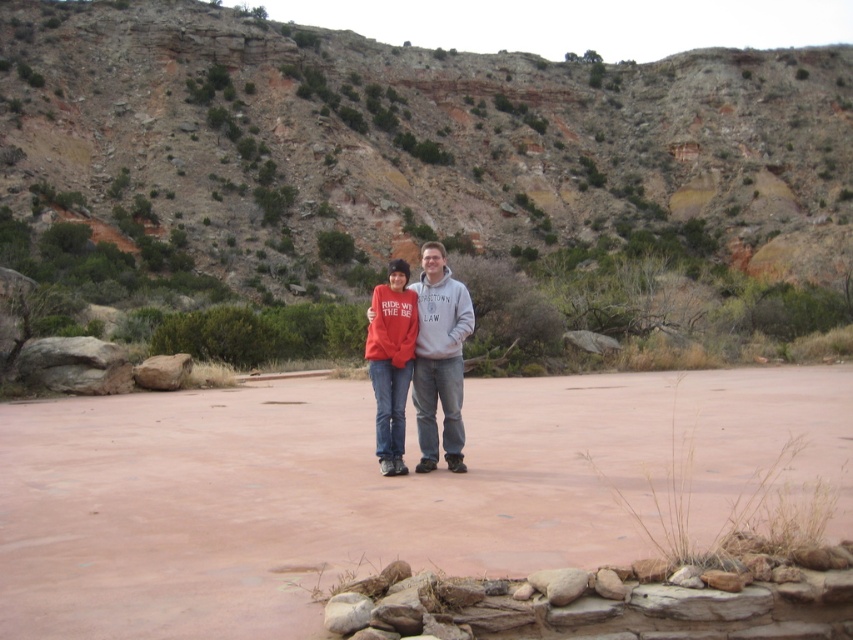
Is matte red hoodie at center below matte red sweatshirt at center?

Yes, matte red hoodie at center is below matte red sweatshirt at center.

In the scene shown: Can you confirm if matte red hoodie at center is taller than matte red sweatshirt at center?

Correct, matte red hoodie at center is much taller as matte red sweatshirt at center.

Where is `matte red hoodie at center`? The image size is (853, 640). matte red hoodie at center is located at coordinates (439, 356).

Can you confirm if dull brown rock at center is smaller than matte red hoodie at center?

No, dull brown rock at center is not smaller than matte red hoodie at center.

Can you confirm if dull brown rock at center is taller than matte red hoodie at center?

Indeed, dull brown rock at center has a greater height compared to matte red hoodie at center.

Is point (404, 145) positioned before point (456, 285)?

No, it is behind (456, 285).

Identify the location of dull brown rock at center. (416, 179).

Is reddish-brown dirt field at center wider than matte red sweatshirt at center?

Yes.

Between reddish-brown dirt field at center and matte red sweatshirt at center, which one appears on the left side from the viewer's perspective?

reddish-brown dirt field at center is more to the left.

Is point (641, 536) in front of point (401, 394)?

Yes.

Find the location of a particular element. The image size is (853, 640). reddish-brown dirt field at center is located at coordinates (378, 490).